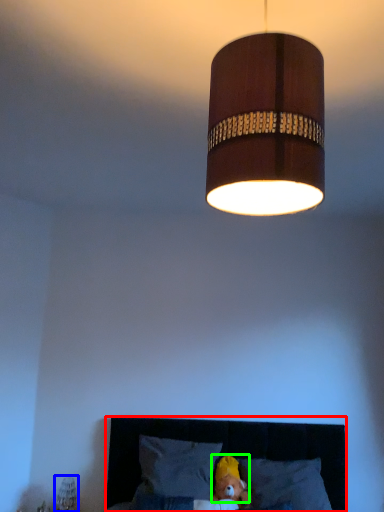
Question: Estimate the real-world distances between objects in this image. Which object is closer to furniture (highlighted by a red box), bedside lamp (highlighted by a blue box) or head (highlighted by a green box)?

Choices:
 (A) bedside lamp
 (B) head

Answer: (B)